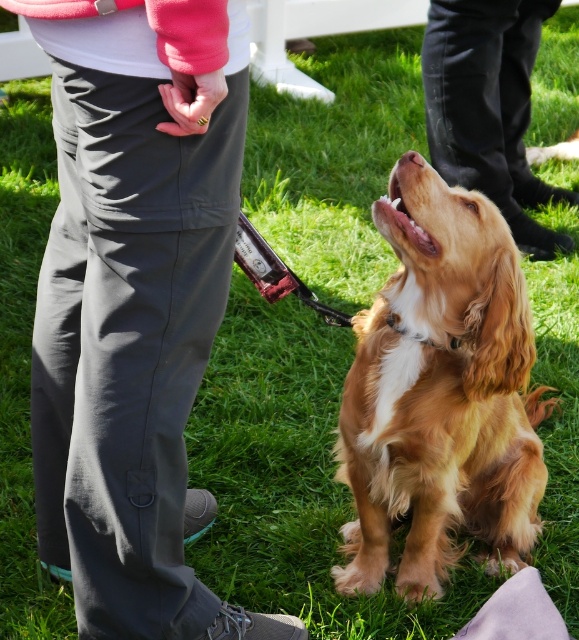
Question: Which point is closer to the camera taking this photo?

Choices:
 (A) (438, 176)
 (B) (467, 120)

Answer: (A)

Question: Where is golden fur dog at center located in relation to black smooth pants at center in the image?

Choices:
 (A) above
 (B) below

Answer: (B)

Question: Does golden fur dog at center come behind black smooth pants at center?

Choices:
 (A) yes
 (B) no

Answer: (B)

Question: Which object is closer to the camera taking this photo?

Choices:
 (A) golden fur dog at center
 (B) black smooth pants at center

Answer: (A)

Question: Which point is farther to the camera?

Choices:
 (A) (427, 67)
 (B) (412, 401)

Answer: (A)

Question: Does golden fur dog at center appear on the left side of black smooth pants at center?

Choices:
 (A) yes
 (B) no

Answer: (A)